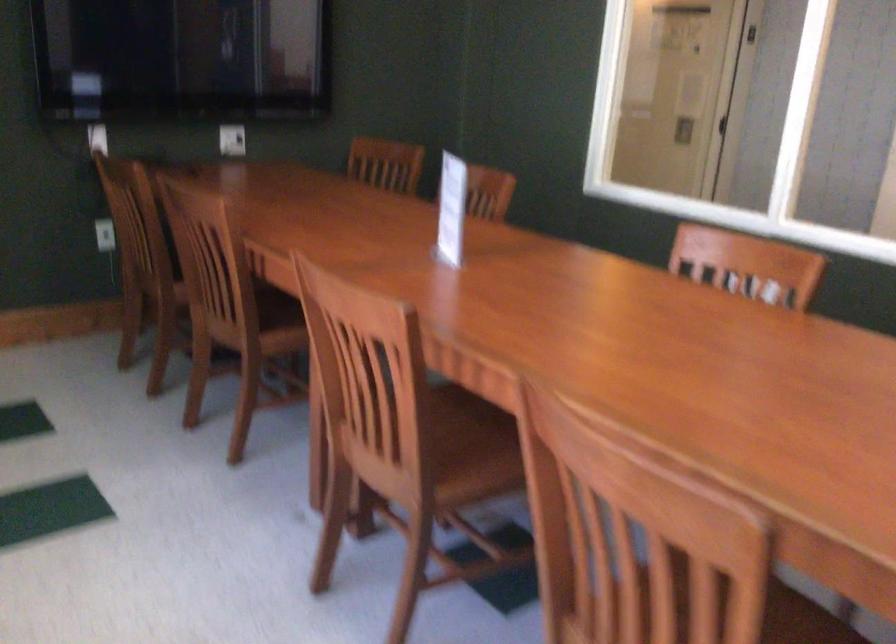
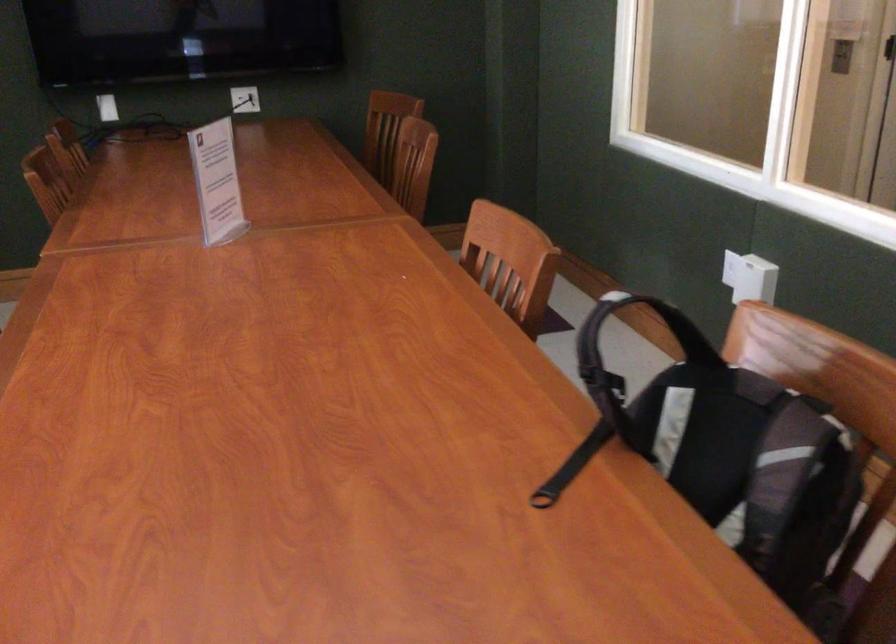
In a continuous first-person perspective shot, in which direction is the camera moving?

The cameraman moved toward right, forward.